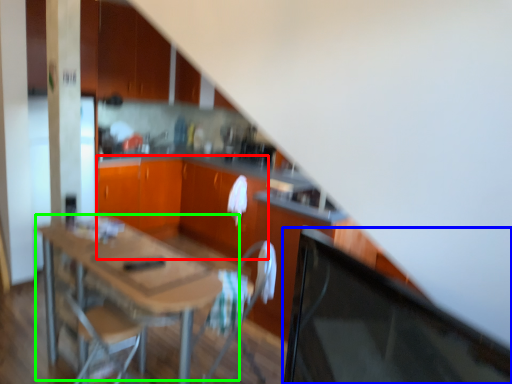
Question: Which object is positioned closest to cabinetry (highlighted by a red box)? Select from computer monitor (highlighted by a blue box) and table (highlighted by a green box).

Choices:
 (A) computer monitor
 (B) table

Answer: (A)